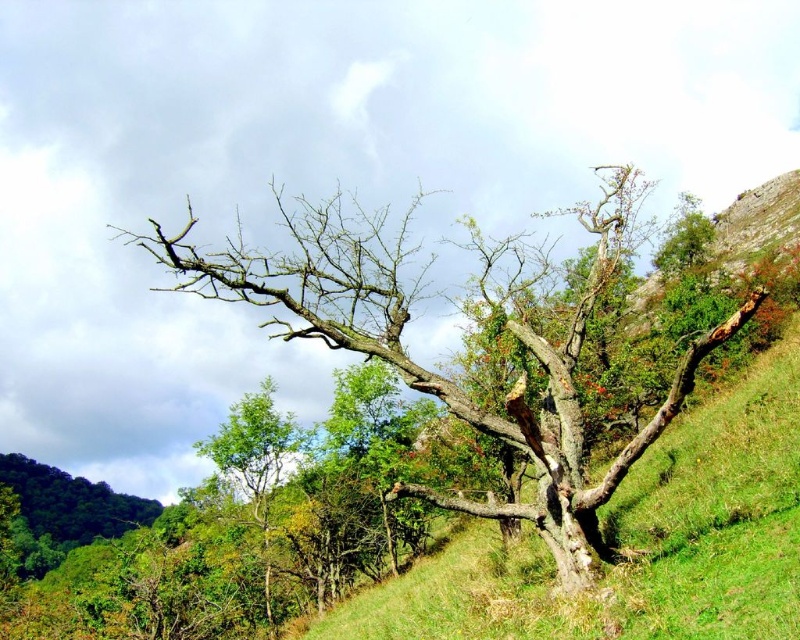
You are a hiker who wants to take a photo of both the barky brown tree at center and the green leafy tree at lower left. Which tree should you stand closer to to capture both in the frame?

The barky brown tree at center might be wider than green leafy tree at lower left, so you should stand closer to the green leafy tree at lower left to ensure both trees fit in the frame.

You are standing at the base of the prominent, gnarled tree in the image. You want to place a 3 meter long wooden bench between the green grassy at center and the tree. Is there enough space to place the bench so that it fits entirely between them?

The distance between the green grassy at center and the tree is 5.85 meters. Since the bench is 3 meters long, there is enough space to place it between them as 3 meters is less than 5.85 meters.

Based on the coordinates provided, what is the color and type of the object located at point (636, 541)?

The point (636, 541) marks green grassy at center.